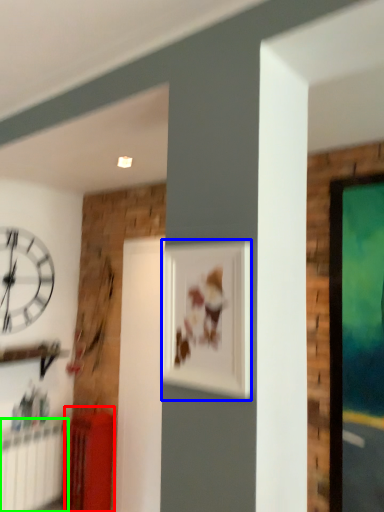
Question: Considering the real-world distances, which object is closest to furniture (highlighted by a red box)? picture frame (highlighted by a blue box) or radiator (highlighted by a green box).

Choices:
 (A) picture frame
 (B) radiator

Answer: (B)